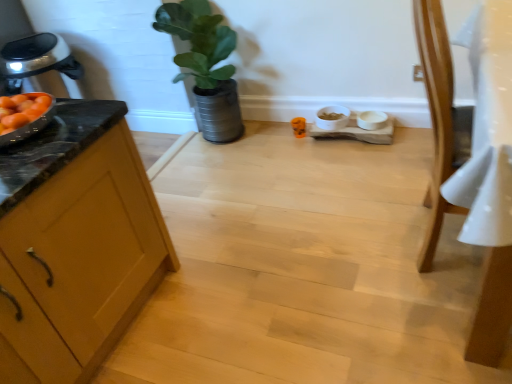
Where is `free space between light brown wooden chair at right and wooden cabinet at left`? The height and width of the screenshot is (384, 512). free space between light brown wooden chair at right and wooden cabinet at left is located at coordinates (275, 274).